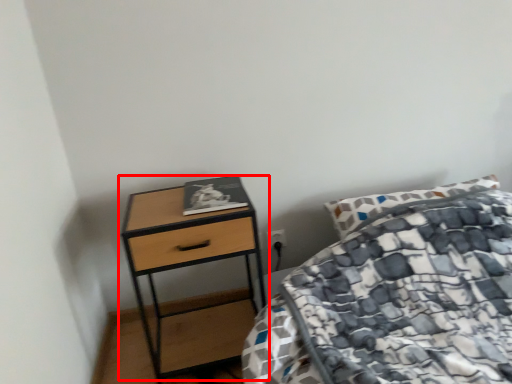
Question: Where is table (annotated by the red box) located in relation to book in the image?

Choices:
 (A) right
 (B) left

Answer: (B)